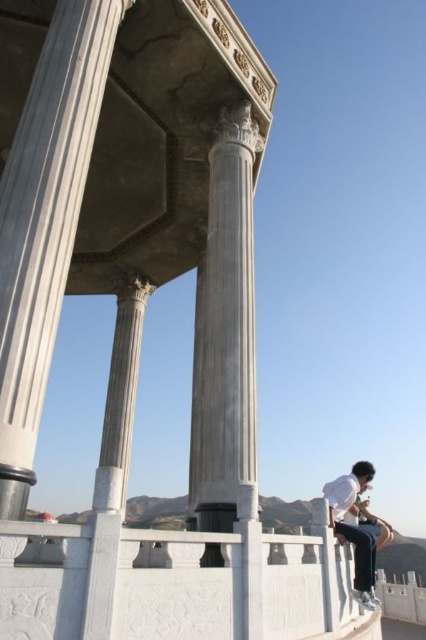
Question: Is white marble pillar at center above white marble column at center?

Choices:
 (A) yes
 (B) no

Answer: (A)

Question: Which point is farther to the camera?

Choices:
 (A) white matte shirt at lower right
 (B) white marble column at center

Answer: (B)

Question: Does white marble pillar at center have a greater width compared to white marble column at center?

Choices:
 (A) no
 (B) yes

Answer: (B)

Question: Where is white marble column at center located in relation to white matte shirt at lower right in the image?

Choices:
 (A) below
 (B) above

Answer: (B)

Question: Which of the following is the closest to the observer?

Choices:
 (A) white marble pillar at center
 (B) white marble column at center

Answer: (A)

Question: Which object is farther from the camera taking this photo?

Choices:
 (A) white matte shirt at lower right
 (B) white marble pillar at center
 (C) white marble column at center

Answer: (C)